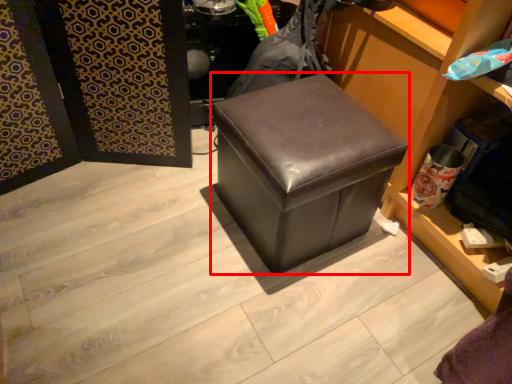
Question: Observing the image, what is the correct spatial positioning of furniture (annotated by the red box) in reference to square?

Choices:
 (A) left
 (B) right

Answer: (A)